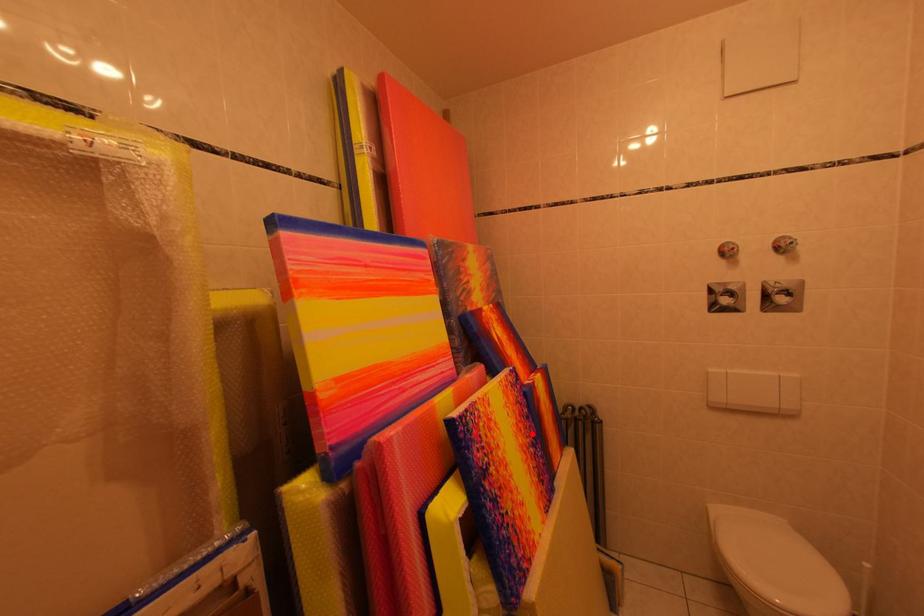
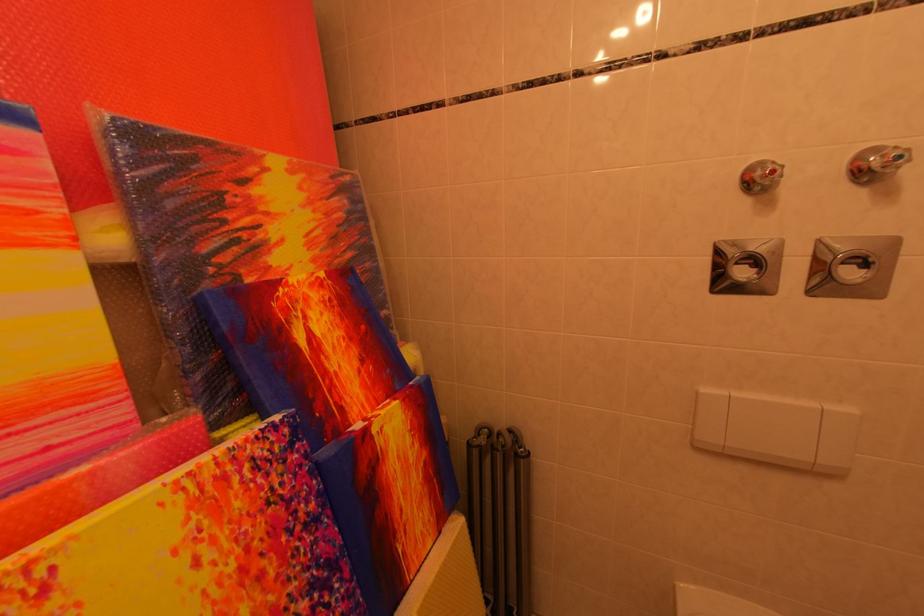
Locate, in the second image, the point that corresponds to the highlighted location in the first image.

(281, 575)